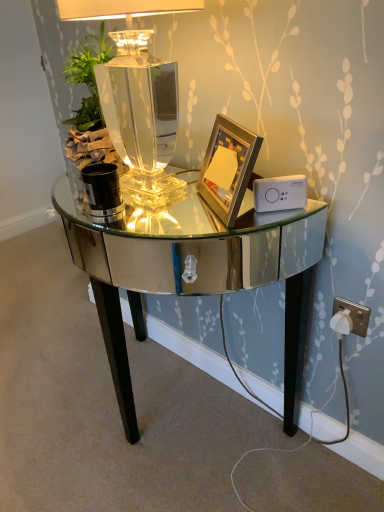
Question: Is clear glass lamp at center thinner than gold metallic picture frame at center?

Choices:
 (A) no
 (B) yes

Answer: (A)

Question: Is gold metallic picture frame at center at the back of clear glass lamp at center?

Choices:
 (A) yes
 (B) no

Answer: (B)

Question: Considering the relative positions of clear glass lamp at center and gold metallic picture frame at center in the image provided, is clear glass lamp at center to the left of gold metallic picture frame at center from the viewer's perspective?

Choices:
 (A) no
 (B) yes

Answer: (B)

Question: From the image's perspective, is clear glass lamp at center above gold metallic picture frame at center?

Choices:
 (A) no
 (B) yes

Answer: (B)

Question: From a real-world perspective, is clear glass lamp at center located higher than gold metallic picture frame at center?

Choices:
 (A) no
 (B) yes

Answer: (B)

Question: From the image's perspective, is shiny mirrored desk at center positioned above or below clear glass lamp at center?

Choices:
 (A) above
 (B) below

Answer: (B)

Question: Considering the positions of shiny mirrored desk at center and clear glass lamp at center in the image, is shiny mirrored desk at center taller or shorter than clear glass lamp at center?

Choices:
 (A) tall
 (B) short

Answer: (A)

Question: In the image, is shiny mirrored desk at center positioned in front of or behind clear glass lamp at center?

Choices:
 (A) behind
 (B) front

Answer: (B)

Question: From a real-world perspective, is shiny mirrored desk at center above or below clear glass lamp at center?

Choices:
 (A) below
 (B) above

Answer: (A)

Question: Considering their positions, is white plastic ipod at right located in front of or behind gold metallic picture frame at center?

Choices:
 (A) behind
 (B) front

Answer: (A)

Question: Considering the positions of white plastic ipod at right and gold metallic picture frame at center in the image, is white plastic ipod at right taller or shorter than gold metallic picture frame at center?

Choices:
 (A) short
 (B) tall

Answer: (A)

Question: Is white plastic ipod at right inside or outside of gold metallic picture frame at center?

Choices:
 (A) inside
 (B) outside

Answer: (B)

Question: Would you say white plastic ipod at right is to the left or to the right of gold metallic picture frame at center in the picture?

Choices:
 (A) left
 (B) right

Answer: (B)

Question: Which is correct: clear glass lamp at center is inside gold metallic picture frame at center, or outside of it?

Choices:
 (A) outside
 (B) inside

Answer: (A)

Question: From a real-world perspective, relative to gold metallic picture frame at center, is clear glass lamp at center vertically above or below?

Choices:
 (A) below
 (B) above

Answer: (B)